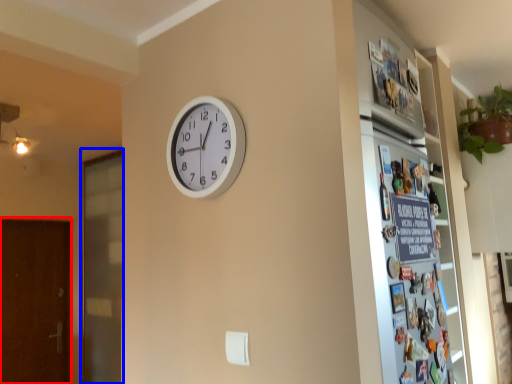
Question: Which object is closer to the camera taking this photo, screen door (highlighted by a red box) or screen door (highlighted by a blue box)?

Choices:
 (A) screen door
 (B) screen door

Answer: (B)